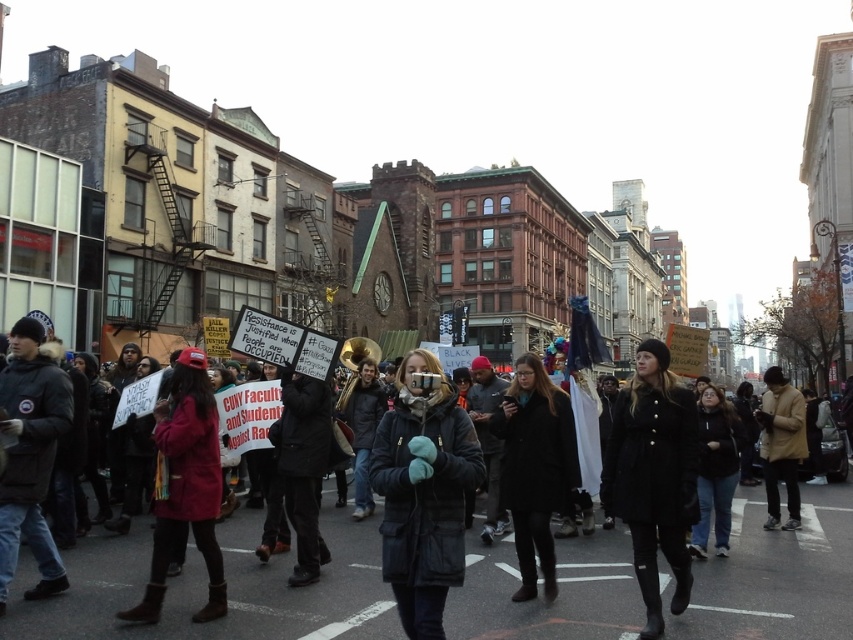
Question: Which point is closer to the camera?

Choices:
 (A) (421, 481)
 (B) (675, 388)

Answer: (A)

Question: Where is red wool coat at lower left located in relation to tan leather jacket at right in the image?

Choices:
 (A) left
 (B) right

Answer: (A)

Question: Is dark blue puffy coat at center positioned at the back of black wool coat at center?

Choices:
 (A) no
 (B) yes

Answer: (A)

Question: Considering the relative positions of black wool coat at center and tan leather jacket at right in the image provided, where is black wool coat at center located with respect to tan leather jacket at right?

Choices:
 (A) below
 (B) above

Answer: (A)

Question: Among these objects, which one is farthest from the camera?

Choices:
 (A) tan leather jacket at right
 (B) black matte coat at center

Answer: (A)

Question: Based on their relative distances, which object is farther from the black wool coat at center?

Choices:
 (A) dark blue puffy coat at center
 (B) red wool coat at lower left
 (C) black matte coat at center
 (D) tan leather jacket at right

Answer: (D)